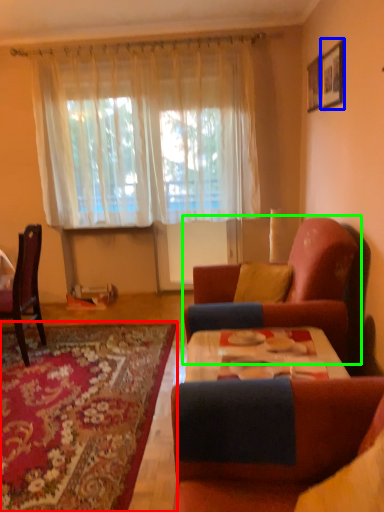
Question: Which object is the closest to the mat (highlighted by a red box)? Choose among these: picture frame (highlighted by a blue box) or studio couch (highlighted by a green box).

Choices:
 (A) picture frame
 (B) studio couch

Answer: (B)